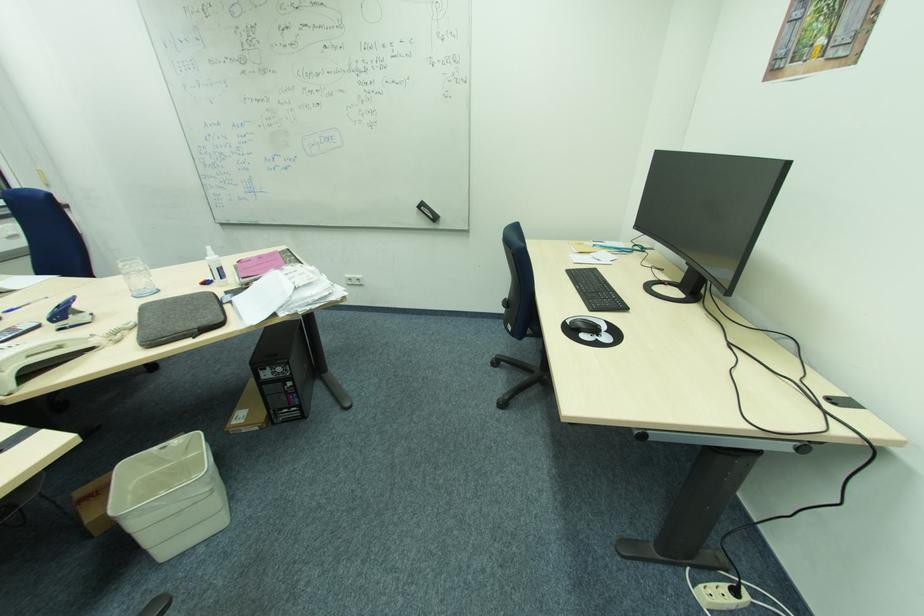
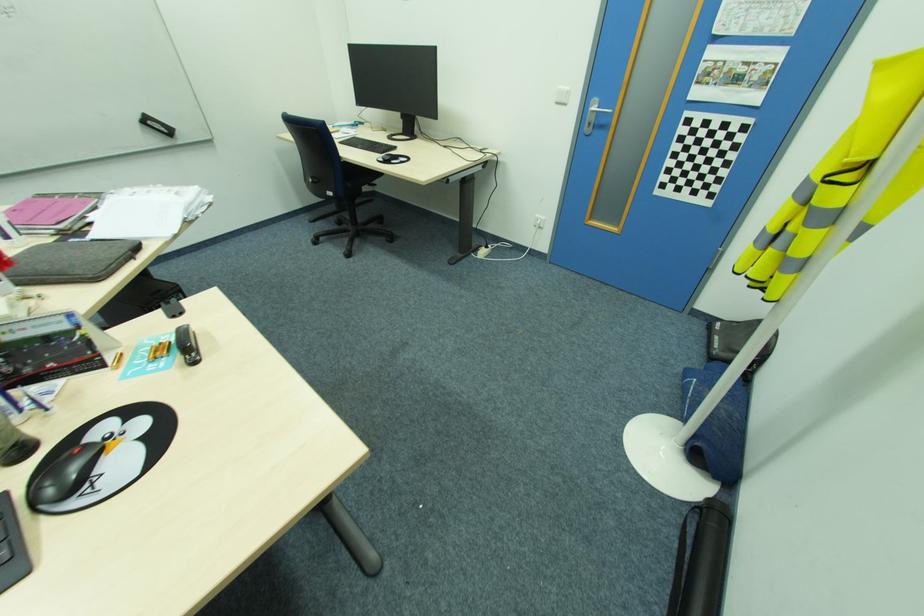
Locate, in the second image, the point that corresponds to (x=153, y=344) in the first image.

(99, 278)